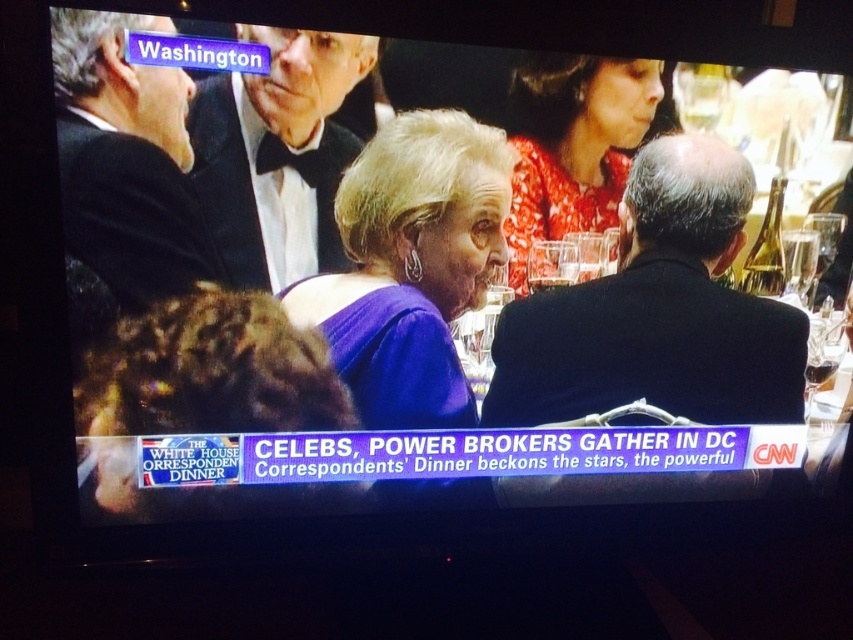
Question: Which object appears farthest from the camera in this image?

Choices:
 (A) purple satin dress at center
 (B) black tuxedo at left
 (C) black tuxedo at upper center
 (D) black suit at center

Answer: (D)

Question: Is purple satin dress at center wider than floral dress at upper center?

Choices:
 (A) yes
 (B) no

Answer: (A)

Question: Does black suit at center appear on the right side of purple satin dress at center?

Choices:
 (A) no
 (B) yes

Answer: (B)

Question: Which object is positioned farthest from the floral dress at upper center?

Choices:
 (A) purple satin dress at center
 (B) black tuxedo at left

Answer: (B)

Question: Is black suit at center wider than black tuxedo at upper center?

Choices:
 (A) no
 (B) yes

Answer: (B)

Question: Which object appears closest to the camera in this image?

Choices:
 (A) black tuxedo at upper center
 (B) floral dress at upper center

Answer: (A)